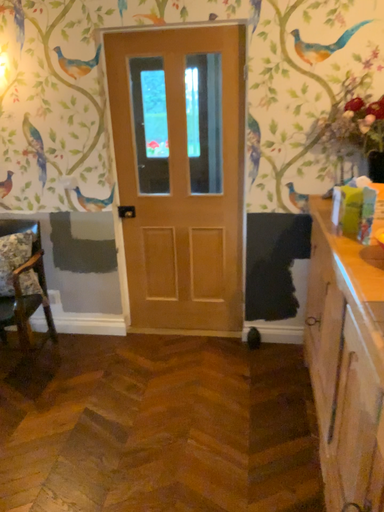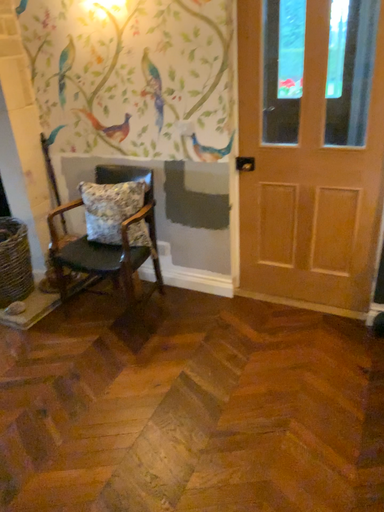
Question: Which way did the camera rotate in the video?

Choices:
 (A) rotated downward
 (B) rotated upward

Answer: (A)